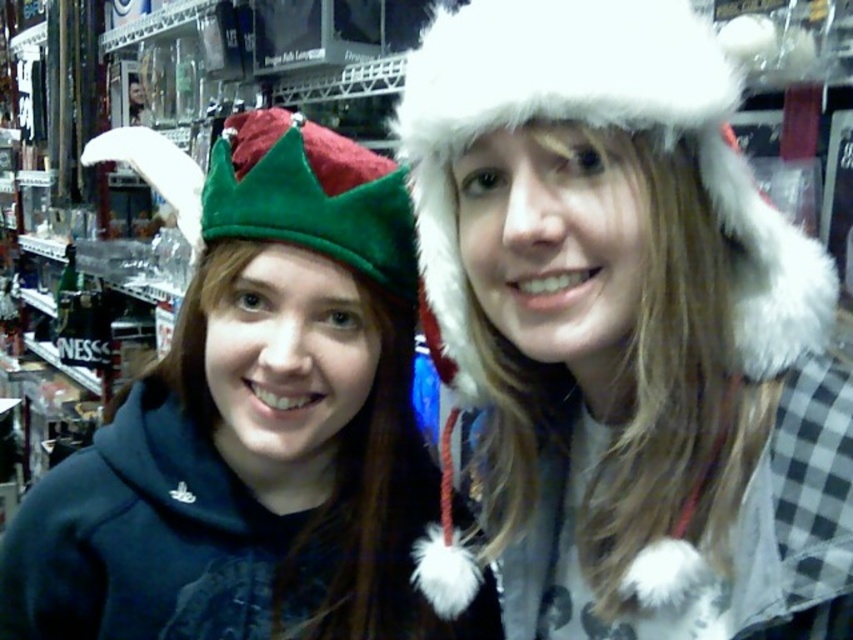
You are a customer in a store and want to find the white furry hat at upper right and the velvet green crown at upper left. If you are standing in the center of the store, which direction should you look to first see both items?

To see both the white furry hat at upper right and the velvet green crown at upper left from the center of the store, you should look towards the upper part of the store since both items are positioned at the upper sections. The white furry hat at upper right is to the right of the velvet green crown at upper left, so looking upwards will allow you to see both items in their respective upper positions.

In the store scene, where is the white furry hat at upper right located in terms of coordinates?

The white furry hat at upper right is located at point (628,326).